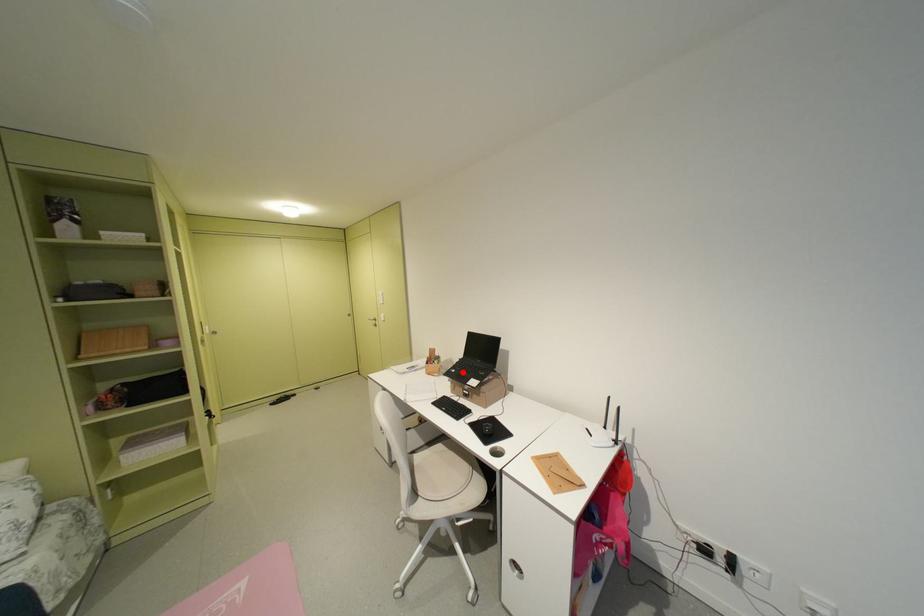
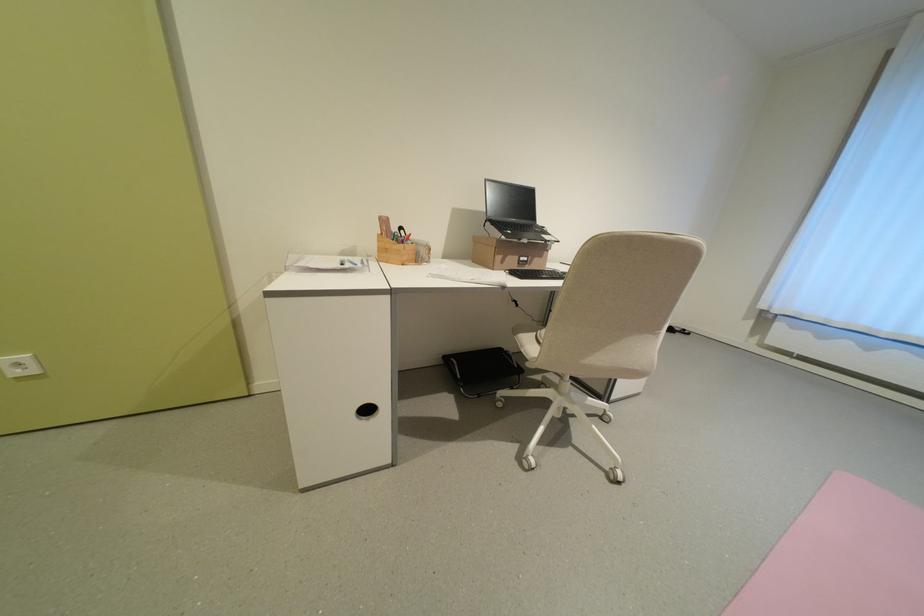
Question: I am providing you with two images of the same scene from different viewpoints. Given a red point in image1, look at the same physical point in image2. Is it:

Choices:
 (A) Closer to the viewpoint
 (B) Farther from the viewpoint

Answer: (A)